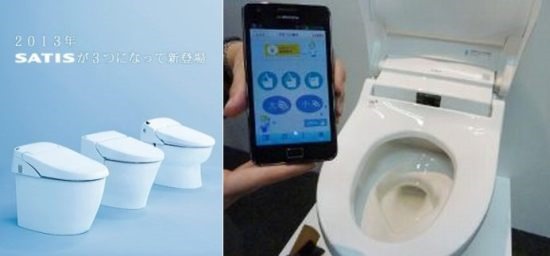
This screenshot has height=256, width=550. I want to click on white wall, so click(528, 154).